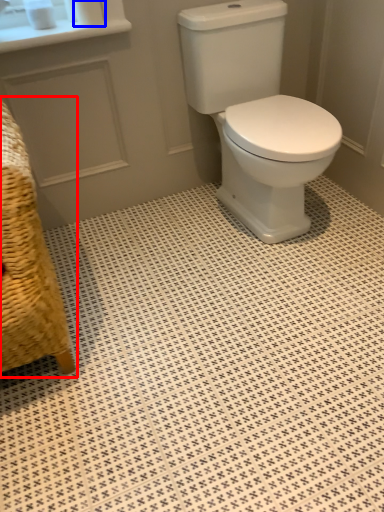
Question: Which object appears closest to the camera in this image, armchair (highlighted by a red box) or toilet paper (highlighted by a blue box)?

Choices:
 (A) armchair
 (B) toilet paper

Answer: (A)